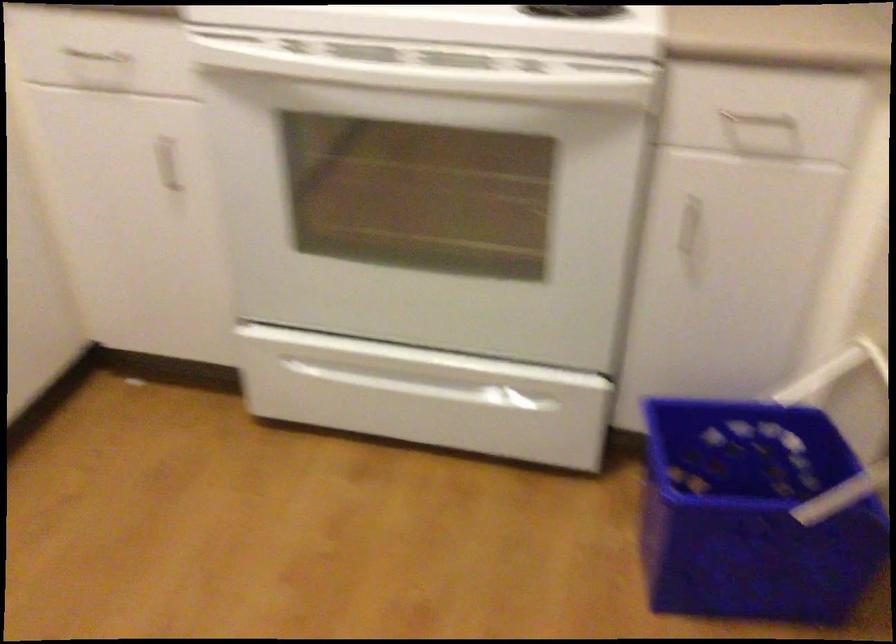
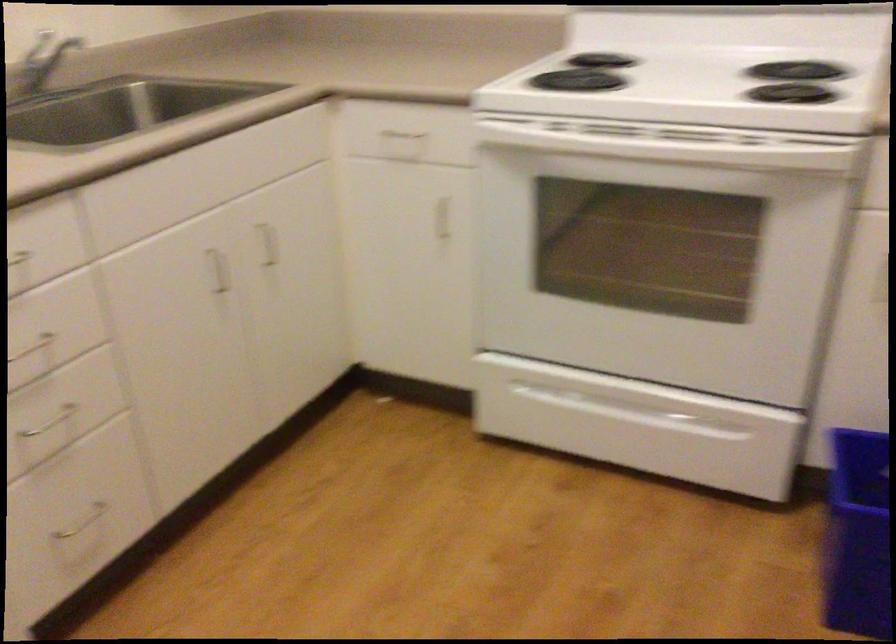
Question: The images are taken continuously from a first-person perspective. In which direction are you moving?

Choices:
 (A) Left
 (B) Right
 (C) Forward
 (D) Backward

Answer: (D)